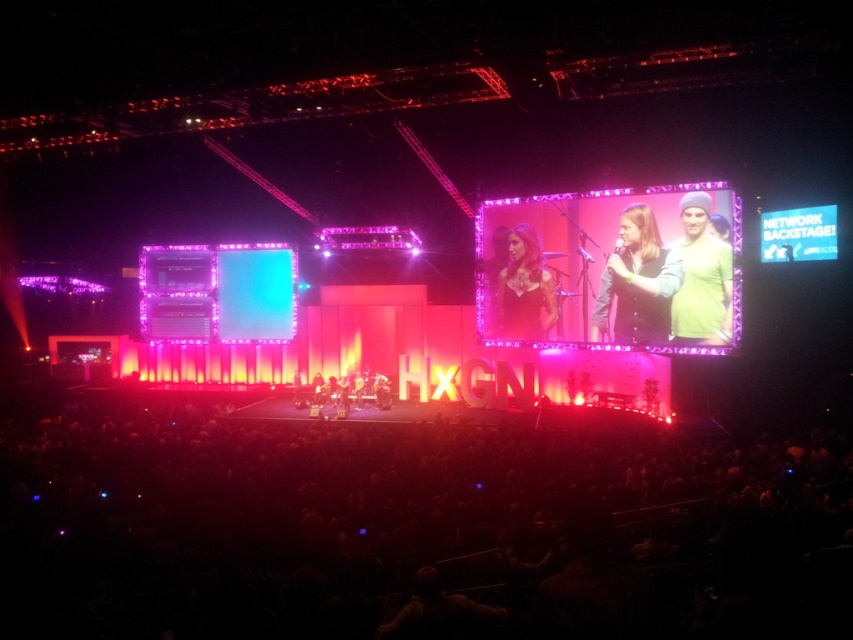
You are a photographer at the event and want to capture a photo that includes both the matte black dress at center and the green knit beanie at upper right. Based on their positions, which object should you focus on first to ensure both are in frame?

The matte black dress at center is shorter than the green knit beanie at upper right, so you should focus on the green knit beanie at upper right first to ensure both are in frame.

You are a photographer at the event and want to capture a photo that includes both the green fabric jacket at upper right and the matte black dress at center. Since you want the dress to be the focal point, which clothing item should you zoom in on more to ensure the dress takes up more space in the photo?

The green fabric jacket at upper right is narrower than the matte black dress at center. To make the matte black dress at center the focal point, you should zoom in more on the dress since it is wider and will occupy more space in the photo when focused on.

You are standing in the audience looking at the stage. There are two points marked on the large screen to the right of the stage. One is at coordinate point (625, 342) and the other at point (711, 340). Which point is closer to you?

Point (625, 342) is closer to you because it is further to the camera than point (711, 340).